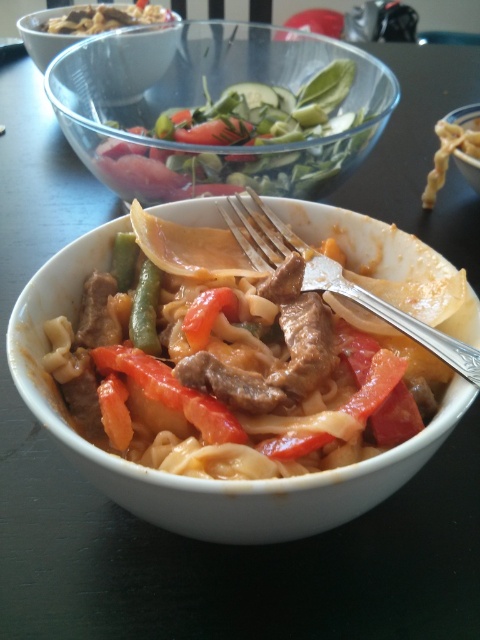
You are a food critic evaluating the arrangement of ingredients in the main dish. The green matte beans at center and red matte tomato at center are part of the dish. How far apart are these two ingredients from each other?

The green matte beans at center and red matte tomato at center are 2.39 inches apart.

You are a photographer trying to capture the main dish in the white bowl. You notice two points marked in the image at coordinates point (110, 60) and point (203, 340). Which point is closer to your camera lens?

Point (110, 60) is further to the camera than point (203, 340), so the point closer to the camera lens is point (110, 60).